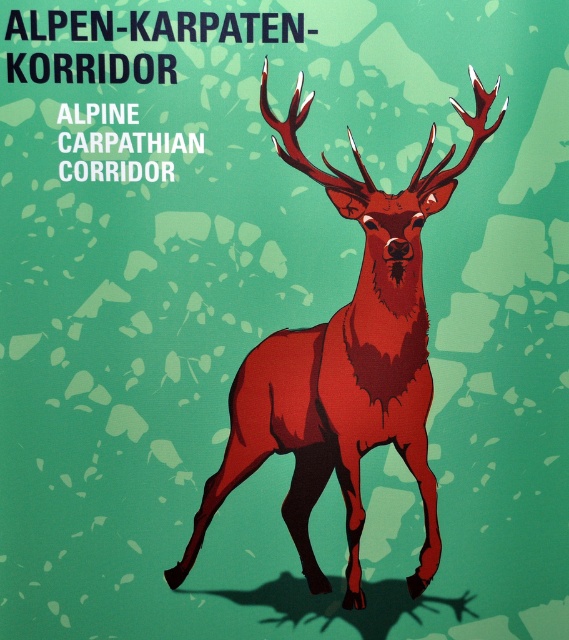
Question: Which point is closer to the camera taking this photo?

Choices:
 (A) (302, 500)
 (B) (451, 147)

Answer: (B)

Question: Does matte red deer at center come in front of shiny red antlers at center?

Choices:
 (A) no
 (B) yes

Answer: (A)

Question: Is matte red deer at center to the left of shiny red antlers at center from the viewer's perspective?

Choices:
 (A) yes
 (B) no

Answer: (A)

Question: Does matte red deer at center appear under shiny red antlers at center?

Choices:
 (A) yes
 (B) no

Answer: (A)